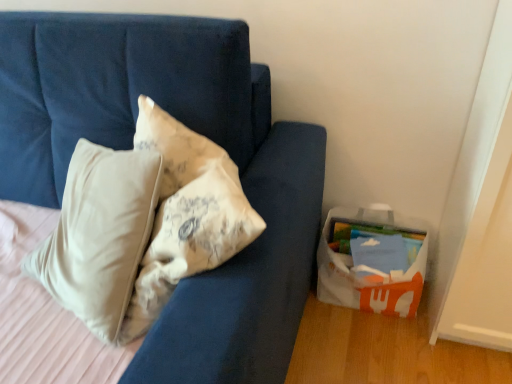
Question: From a real-world perspective, is blue fabric couch at center physically located above or below white plastic basket at lower right?

Choices:
 (A) above
 (B) below

Answer: (A)

Question: Choose the correct answer: Is blue fabric couch at center inside white plastic basket at lower right or outside it?

Choices:
 (A) inside
 (B) outside

Answer: (B)

Question: Is blue fabric couch at center wider or thinner than white plastic basket at lower right?

Choices:
 (A) thin
 (B) wide

Answer: (B)

Question: From a real-world perspective, relative to blue fabric couch at center, is white plastic basket at lower right vertically above or below?

Choices:
 (A) above
 (B) below

Answer: (B)

Question: Is point (420, 253) positioned closer to the camera than point (70, 99)?

Choices:
 (A) closer
 (B) farther

Answer: (B)

Question: In terms of width, does white plastic basket at lower right look wider or thinner when compared to blue fabric couch at center?

Choices:
 (A) thin
 (B) wide

Answer: (A)

Question: Is white plastic basket at lower right in front of or behind blue fabric couch at center in the image?

Choices:
 (A) front
 (B) behind

Answer: (B)